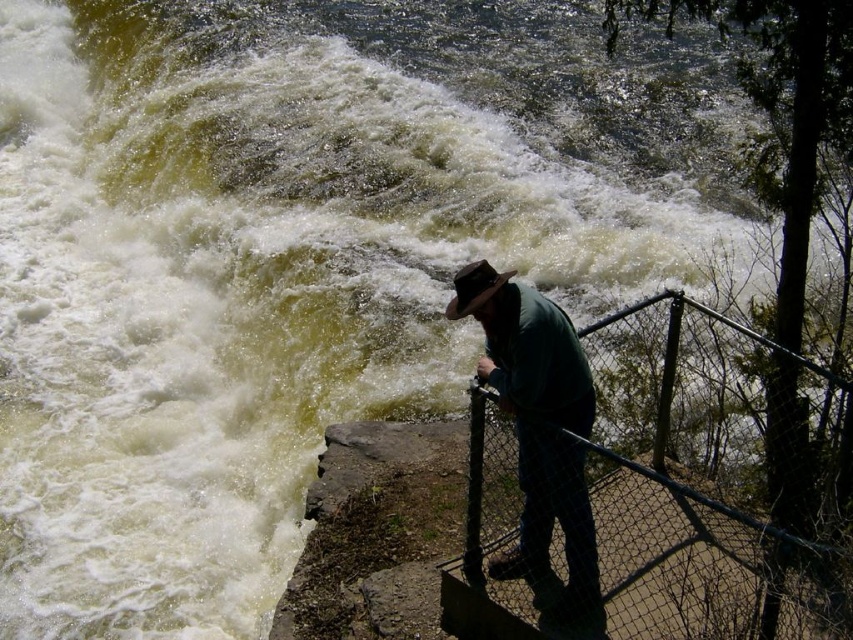
You are a photographer trying to capture the waterfall in the image. You want to ensure the black wire mesh fence at lower right and the green matte shirt at center are both visible in your shot. Based on their positions, which object should appear higher in the photo?

The green matte shirt at center appears higher in the photo because the black wire mesh fence at lower right is positioned below it.

You are a photographer standing at the edge of the waterfall. You want to take a photo of the black wire mesh fence at lower right without including the person in the frame. Given that the fence is 7.94 meters away from you, can you step back to ensure the person is out of the shot?

The black wire mesh fence at lower right is 7.94 meters away from the camera. Since you are currently at the edge, stepping back might allow you to frame the shot so the person is excluded, but the exact distance needed depends on your camera lens and angle. However, the given information only specifies the fence distance, so we cannot confirm if stepping back 7.94 meters would exclude the person without additional details.

Consider the image. You are standing at the point closest to the waterfall. Which point, point (482, 602) or point (521, 442), is farther away from you?

Point (482, 602) is behind point (521, 442), so it is farther away from you.